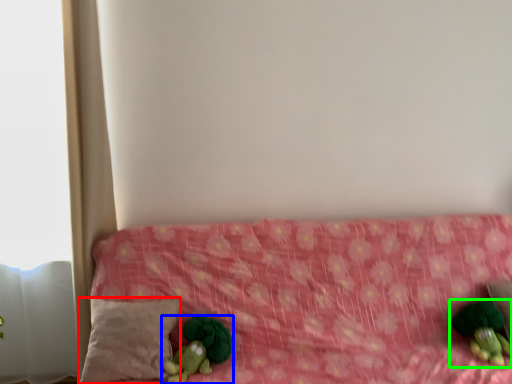
Question: Which is nearer to the pillow (highlighted by a red box)? toy (highlighted by a blue box) or toy (highlighted by a green box).

Choices:
 (A) toy
 (B) toy

Answer: (A)